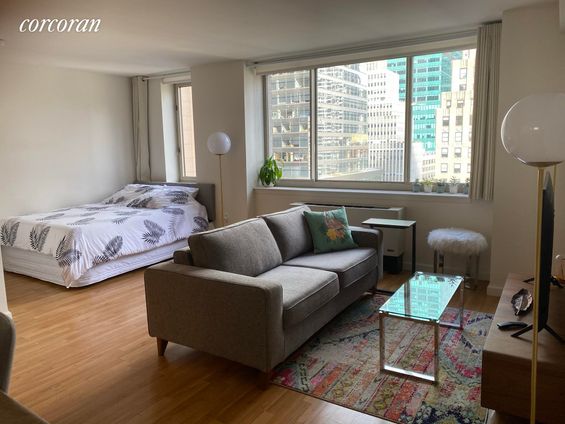
Image resolution: width=565 pixels, height=424 pixels. I want to click on floor, so click(86, 353).